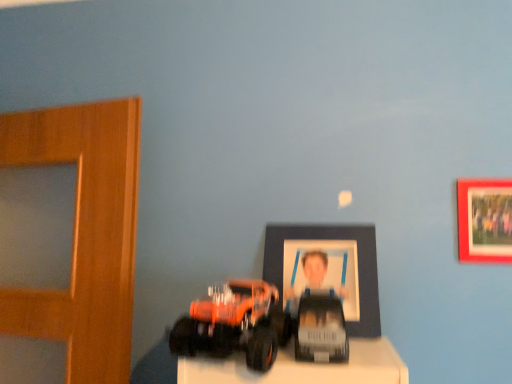
Question: Can you confirm if matte red picture frame at upper right, which is the first picture frame from right to left, is thinner than matte plastic picture frame at center, which is the 2th picture frame from right to left?

Choices:
 (A) no
 (B) yes

Answer: (B)

Question: From a real-world perspective, is matte red picture frame at upper right, which is the 2th picture frame in left-to-right order, physically below matte plastic picture frame at center, which is the 2th picture frame from right to left?

Choices:
 (A) yes
 (B) no

Answer: (B)

Question: Does matte red picture frame at upper right, which is the 2th picture frame in left-to-right order, have a smaller size compared to matte plastic picture frame at center, placed as the 1th picture frame when sorted from left to right?

Choices:
 (A) yes
 (B) no

Answer: (A)

Question: Is matte red picture frame at upper right, which is the 2th picture frame in left-to-right order, located outside matte plastic picture frame at center, placed as the 1th picture frame when sorted from left to right?

Choices:
 (A) no
 (B) yes

Answer: (B)

Question: Is matte red picture frame at upper right, which is the first picture frame from right to left, oriented away from matte plastic picture frame at center, which is the 2th picture frame from right to left?

Choices:
 (A) no
 (B) yes

Answer: (A)

Question: From the image's perspective, is matte red picture frame at upper right, which is the 2th picture frame in left-to-right order, positioned above or below matte plastic picture frame at center, placed as the 1th picture frame when sorted from left to right?

Choices:
 (A) above
 (B) below

Answer: (A)

Question: Is matte red picture frame at upper right, which is the 2th picture frame in left-to-right order, inside or outside of matte plastic picture frame at center, which is the 2th picture frame from right to left?

Choices:
 (A) inside
 (B) outside

Answer: (B)

Question: Looking at their shapes, would you say matte red picture frame at upper right, which is the 2th picture frame in left-to-right order, is wider or thinner than matte plastic picture frame at center, which is the 2th picture frame from right to left?

Choices:
 (A) thin
 (B) wide

Answer: (A)

Question: Is point (463, 188) closer or farther from the camera than point (355, 238)?

Choices:
 (A) farther
 (B) closer

Answer: (B)

Question: Considering the positions of shiny metallic car at center, positioned as the 2th toy in left-to-right order, and orange matte truck at lower left, which ranks as the 1th toy in left-to-right order, in the image, is shiny metallic car at center, positioned as the 2th toy in left-to-right order, taller or shorter than orange matte truck at lower left, which ranks as the 1th toy in left-to-right order,?

Choices:
 (A) short
 (B) tall

Answer: (A)

Question: Would you say shiny metallic car at center, the 1th toy in the right-to-left sequence, is to the left or to the right of orange matte truck at lower left, which is the 2th toy from right to left, in the picture?

Choices:
 (A) left
 (B) right

Answer: (B)

Question: Is shiny metallic car at center, positioned as the 2th toy in left-to-right order, in front of or behind orange matte truck at lower left, which is the 2th toy from right to left, in the image?

Choices:
 (A) behind
 (B) front

Answer: (A)

Question: From a real-world perspective, is shiny metallic car at center, the 1th toy in the right-to-left sequence, positioned above or below orange matte truck at lower left, which is the 2th toy from right to left?

Choices:
 (A) below
 (B) above

Answer: (A)

Question: Is point (464, 206) closer or farther from the camera than point (287, 312)?

Choices:
 (A) closer
 (B) farther

Answer: (B)

Question: Choose the correct answer: Is matte red picture frame at upper right, which is the 2th picture frame in left-to-right order, inside orange matte truck at lower left, which ranks as the 1th toy in left-to-right order, or outside it?

Choices:
 (A) outside
 (B) inside

Answer: (A)